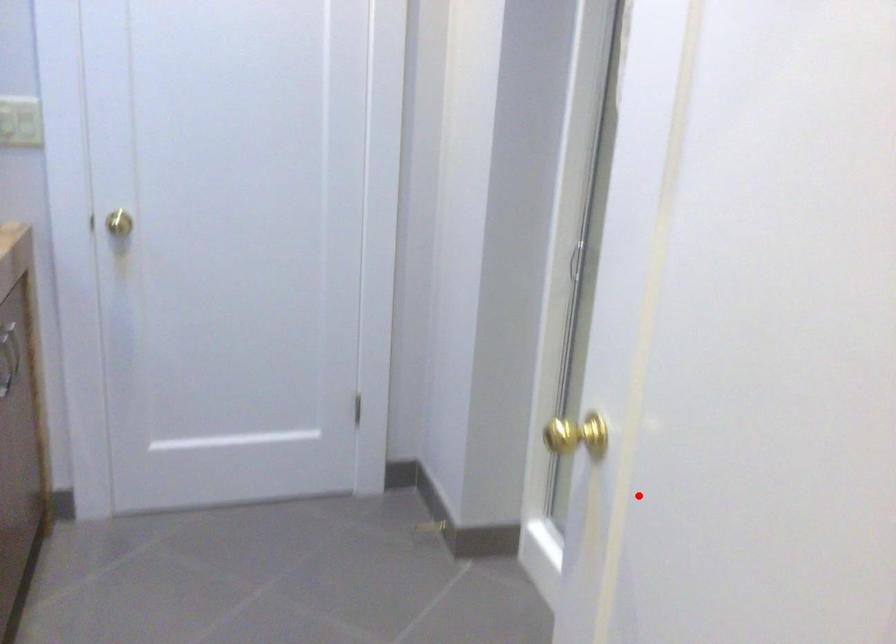
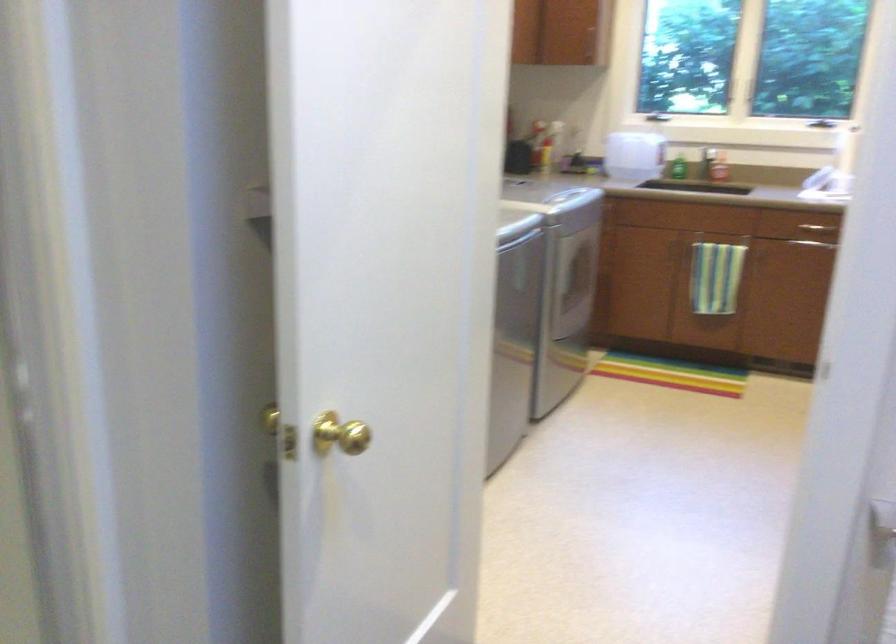
Question: I am providing you with two images of the same scene from different viewpoints. A red point is shown in image1. For the corresponding object point in image2, is it positioned nearer or farther from the camera?

Choices:
 (A) Nearer
 (B) Farther

Answer: (B)